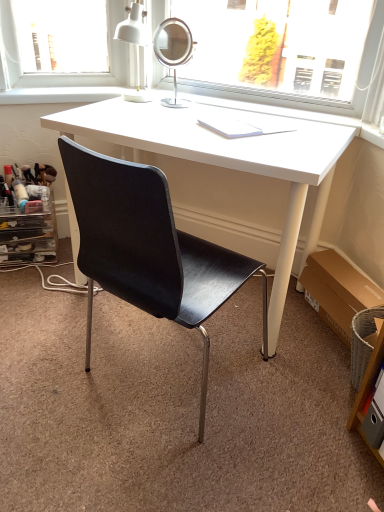
In order to click on free point in front of white glossy desk at center in this screenshot , I will do [x=191, y=432].